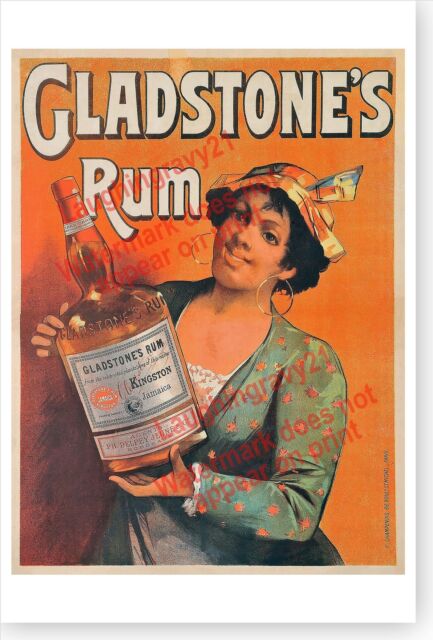
Identify the location of coat. This screenshot has width=433, height=640. (281, 349).